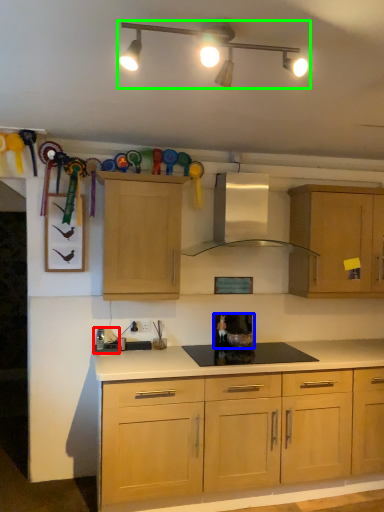
Question: Which object is the farthest from appliance (highlighted by a red box)? Choose among these: appliance (highlighted by a blue box) or light fixture (highlighted by a green box).

Choices:
 (A) appliance
 (B) light fixture

Answer: (B)